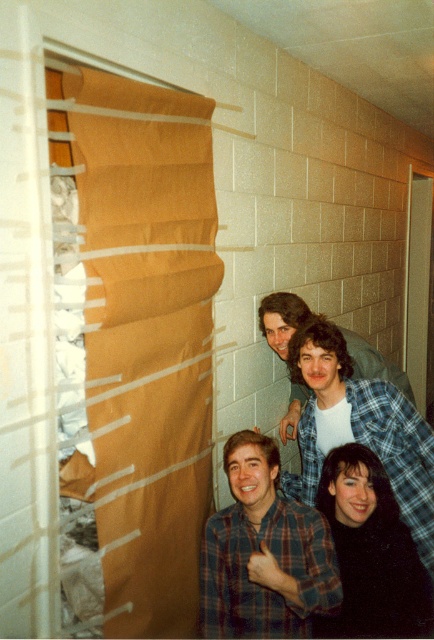
Question: Can you confirm if plaid flannel shirt at center is positioned to the right of matte plaid shirt at center?

Choices:
 (A) yes
 (B) no

Answer: (A)

Question: Is plaid flannel shirt at center above matte plaid shirt at center?

Choices:
 (A) yes
 (B) no

Answer: (B)

Question: Which point is farther to the camera?

Choices:
 (A) plaid flannel shirt at center
 (B) black matte shirt at lower right

Answer: (A)

Question: Which point is closer to the camera taking this photo?

Choices:
 (A) (377, 413)
 (B) (201, 596)

Answer: (B)

Question: Can you confirm if plaid flannel shirt at center is positioned to the left of black matte shirt at lower right?

Choices:
 (A) no
 (B) yes

Answer: (B)

Question: Which object is positioned closest to the plaid flannel shirt at lower center?

Choices:
 (A) black matte shirt at lower right
 (B) plaid flannel shirt at center

Answer: (A)